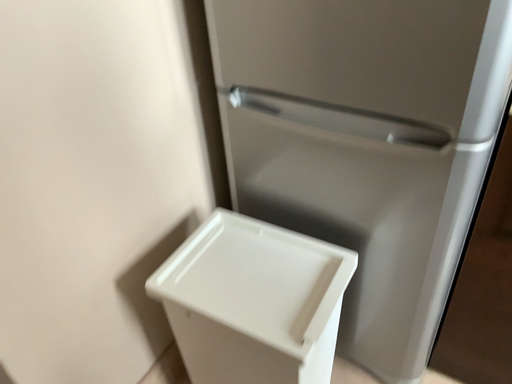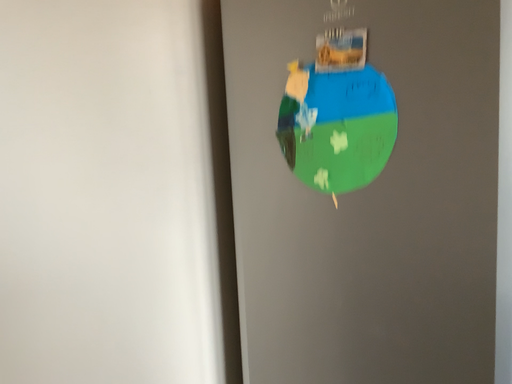
Question: Which way did the camera rotate in the video?

Choices:
 (A) rotated upward
 (B) rotated downward

Answer: (A)